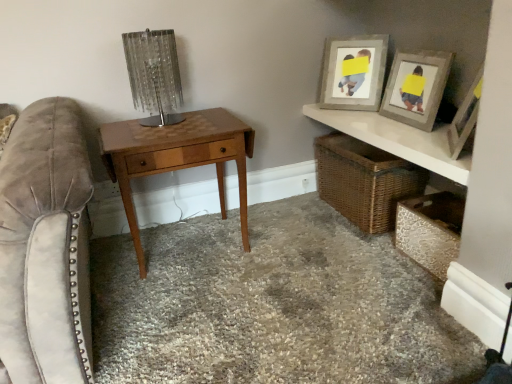
This screenshot has width=512, height=384. I want to click on free point above light brown wood table at center (from a real-world perspective), so click(x=180, y=124).